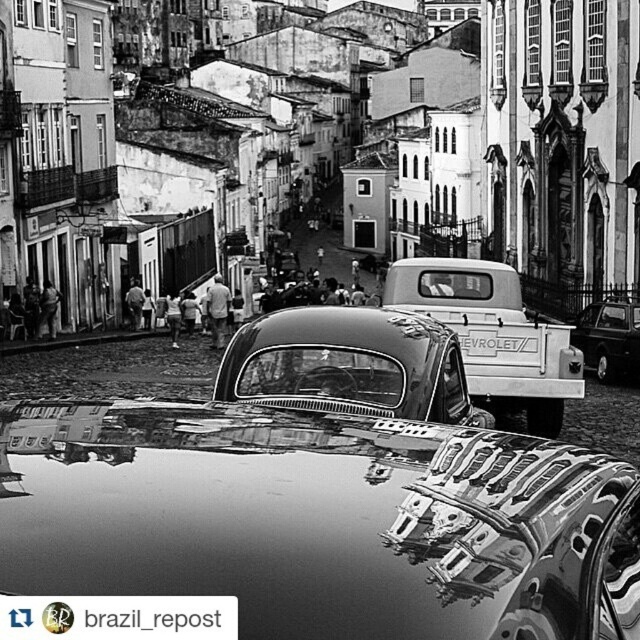
You are a photographer aiming to capture the reflection of the white matte Chevrolet truck at center in the puddle. Based on the scene, where should you position yourself to ensure the truck is fully reflected in the puddle?

The white matte Chevrolet truck at center is located at point (493, 333), so you should position yourself directly above or near that coordinate to capture its full reflection in the puddle.